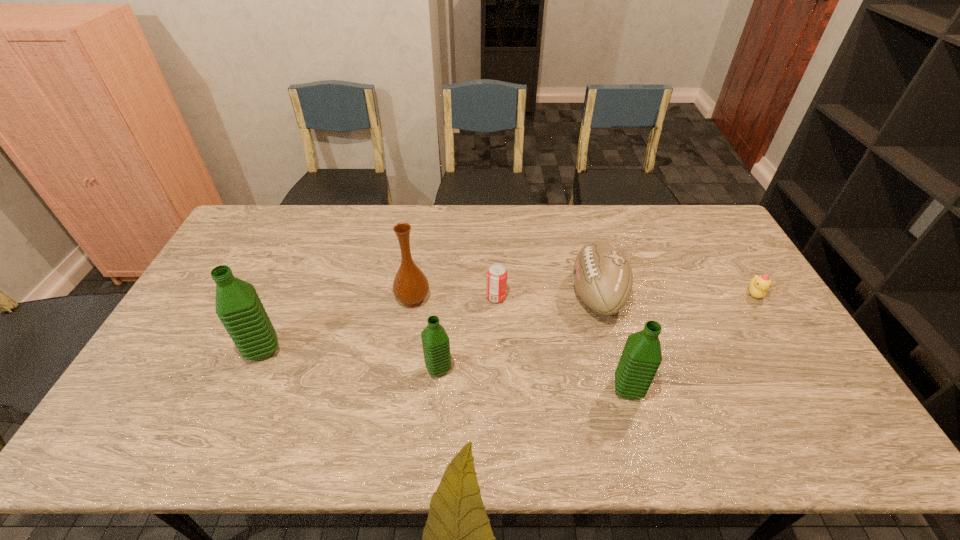
I want to click on water bottle object that ranks as the second closest to the soda can, so click(641, 357).

Image resolution: width=960 pixels, height=540 pixels. What are the coordinates of `vacant position in the image that satisfies the following two spatial constraints: 1. on the laces of the third shortest object; 2. on the front side of the tallest water bottle` in the screenshot? It's located at (612, 350).

This screenshot has width=960, height=540. Identify the location of vacant space that satisfies the following two spatial constraints: 1. on the front side of the sixth object from right to left; 2. on the left side of the second water bottle from right to left. (x=402, y=369).

Locate an element on the screen. The height and width of the screenshot is (540, 960). vacant space that satisfies the following two spatial constraints: 1. on the back side of the sixth object from right to left; 2. on the right side of the soda can is located at coordinates (413, 298).